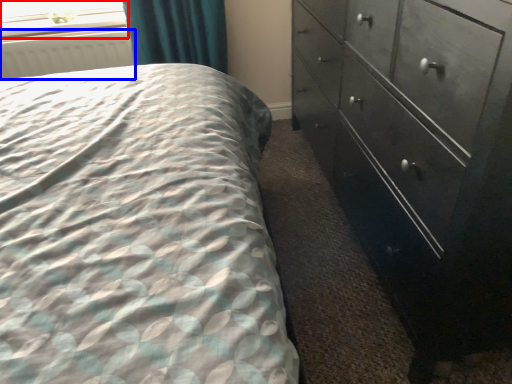
Question: Which of the following is the farthest to the observer, window screen (highlighted by a red box) or radiator (highlighted by a blue box)?

Choices:
 (A) window screen
 (B) radiator

Answer: (A)